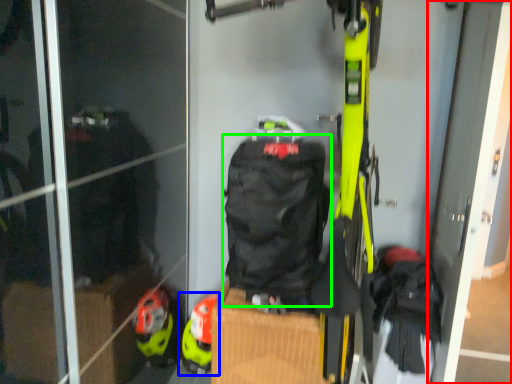
Question: Which object is positioned closest to screen door (highlighted by a red box)? Select from footwear (highlighted by a blue box) and backpack (highlighted by a green box).

Choices:
 (A) footwear
 (B) backpack

Answer: (B)